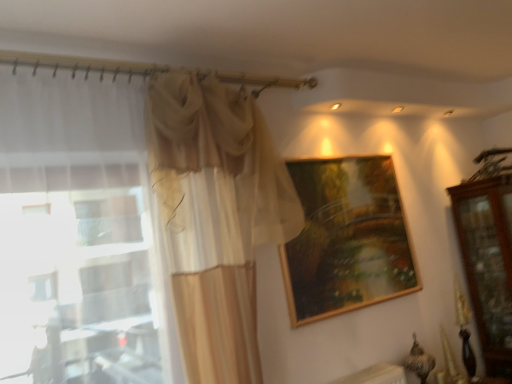
The image size is (512, 384). What do you see at coordinates (488, 263) in the screenshot?
I see `mahogany wooden dresser at right` at bounding box center [488, 263].

At what (x,y) coordinates should I click in order to perform the action: click on mahogany wooden dresser at right. Please return your answer as a coordinate pair (x, y). The height and width of the screenshot is (384, 512). Looking at the image, I should click on (488, 263).

Which is correct: sheer beige curtain at left is inside wooden frame at upper center, or outside of it?

sheer beige curtain at left is located beyond the bounds of wooden frame at upper center.

In order to click on picture frame on the right of sheer beige curtain at left in this screenshot , I will do `click(346, 239)`.

Is point (126, 138) closer or farther from the camera than point (330, 263)?

Point (126, 138).

From a real-world perspective, who is located higher, sheer beige curtain at left or wooden frame at upper center?

sheer beige curtain at left.

Which object is further away from the camera taking this photo, mahogany wooden dresser at right or wooden frame at upper center?

mahogany wooden dresser at right is further from the camera.

What's the angular difference between mahogany wooden dresser at right and wooden frame at upper center's facing directions?

The facing directions of mahogany wooden dresser at right and wooden frame at upper center are 0.00155 degrees apart.

From the image's perspective, between mahogany wooden dresser at right and wooden frame at upper center, which one is located above?

From the image's view, wooden frame at upper center is above.

How many degrees apart are the facing directions of wooden frame at upper center and mahogany wooden dresser at right?

0.00155 degrees.

I want to click on dresser behind the wooden frame at upper center, so click(x=488, y=263).

From a real-world perspective, between wooden frame at upper center and mahogany wooden dresser at right, who is vertically lower?

mahogany wooden dresser at right, from a real-world perspective.

Is point (481, 315) in front of point (175, 127)?

No, it is behind (175, 127).

Is mahogany wooden dresser at right facing towards sheer beige curtain at left?

No, mahogany wooden dresser at right is not aimed at sheer beige curtain at left.

In the scene shown: Between mahogany wooden dresser at right and sheer beige curtain at left, which one has less height?

mahogany wooden dresser at right.

From a real-world perspective, between mahogany wooden dresser at right and sheer beige curtain at left, who is vertically lower?

From a 3D spatial view, mahogany wooden dresser at right is below.

Considering the sizes of objects wooden frame at upper center and sheer beige curtain at left in the image provided, who is shorter, wooden frame at upper center or sheer beige curtain at left?

wooden frame at upper center.

Consider the image. Is the depth of wooden frame at upper center less than that of sheer beige curtain at left?

No, it is not.

Would you say sheer beige curtain at left is part of wooden frame at upper center's contents?

No, sheer beige curtain at left is not a part of wooden frame at upper center.

Considering the sizes of objects wooden frame at upper center and sheer beige curtain at left in the image provided, who is bigger, wooden frame at upper center or sheer beige curtain at left?

Bigger between the two is sheer beige curtain at left.

From the image's perspective, between sheer beige curtain at left and mahogany wooden dresser at right, which one is located above?

sheer beige curtain at left appears higher in the image.

Is point (116, 282) closer to viewer compared to point (470, 203)?

Yes.

Considering the sizes of objects sheer beige curtain at left and mahogany wooden dresser at right in the image provided, who is shorter, sheer beige curtain at left or mahogany wooden dresser at right?

Standing shorter between the two is mahogany wooden dresser at right.

Is sheer beige curtain at left positioned with its back to mahogany wooden dresser at right?

No, sheer beige curtain at left's orientation is not away from mahogany wooden dresser at right.

Locate an element on the screen. picture frame behind the sheer beige curtain at left is located at coordinates (346, 239).

The width and height of the screenshot is (512, 384). Identify the location of dresser located on the right of wooden frame at upper center. (488, 263).

Estimate the real-world distances between objects in this image. Which object is further from mahogany wooden dresser at right, wooden frame at upper center or sheer beige curtain at left?

sheer beige curtain at left.

Looking at the image, which one is located closer to wooden frame at upper center, sheer beige curtain at left or mahogany wooden dresser at right?

sheer beige curtain at left.

Estimate the real-world distances between objects in this image. Which object is further from mahogany wooden dresser at right, sheer beige curtain at left or wooden frame at upper center?

Based on the image, sheer beige curtain at left appears to be further to mahogany wooden dresser at right.

Looking at the image, which one is located further to sheer beige curtain at left, wooden frame at upper center or mahogany wooden dresser at right?

Among the two, mahogany wooden dresser at right is located further to sheer beige curtain at left.

Considering their positions, is mahogany wooden dresser at right positioned closer to wooden frame at upper center than sheer beige curtain at left?

The object closer to wooden frame at upper center is sheer beige curtain at left.

Estimate the real-world distances between objects in this image. Which object is further from sheer beige curtain at left, mahogany wooden dresser at right or wooden frame at upper center?

mahogany wooden dresser at right is further to sheer beige curtain at left.

This screenshot has width=512, height=384. What are the coordinates of `picture frame between sheer beige curtain at left and mahogany wooden dresser at right from left to right` in the screenshot? It's located at (346, 239).